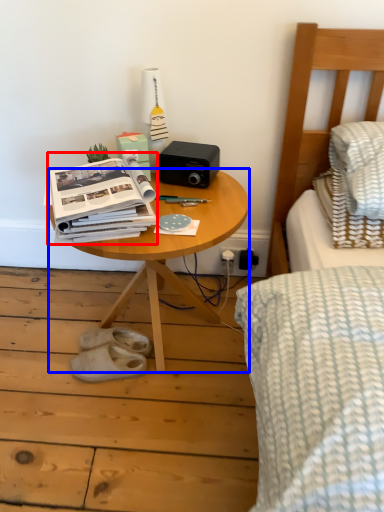
Question: Which object appears closest to the camera in this image, paperback book (highlighted by a red box) or table (highlighted by a blue box)?

Choices:
 (A) paperback book
 (B) table

Answer: (A)